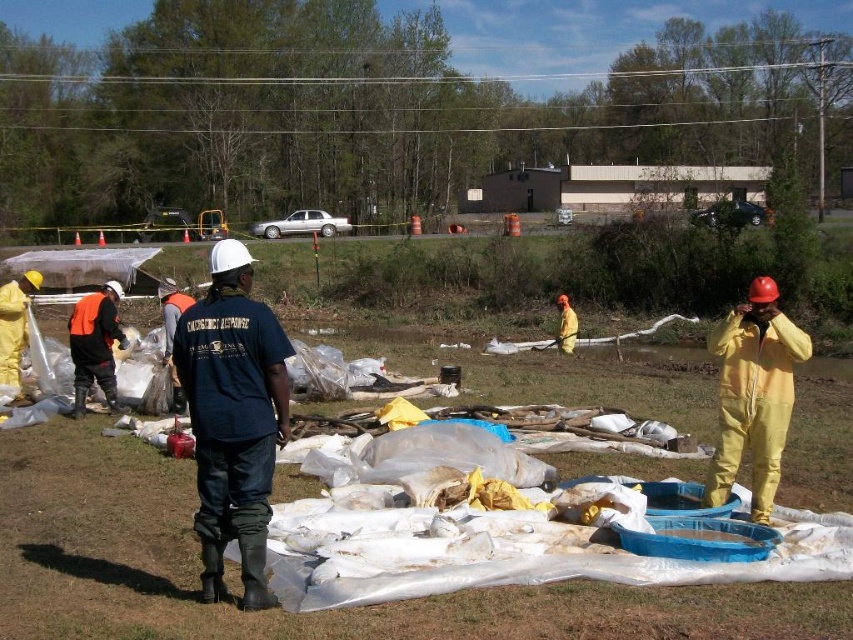
Can you confirm if yellow rubber boots at center is thinner than yellow matte suit at right?

In fact, yellow rubber boots at center might be wider than yellow matte suit at right.

Who is taller, yellow rubber boots at center or yellow matte suit at right?

yellow rubber boots at center

What do you see at coordinates (276, 611) in the screenshot?
I see `yellow rubber boots at center` at bounding box center [276, 611].

At what (x,y) coordinates should I click in order to perform the action: click on yellow rubber boots at center. Please return your answer as a coordinate pair (x, y). Looking at the image, I should click on (276, 611).

Between yellow rubber boots at center and black matte shirt at center, which one is positioned lower?

Positioned lower is black matte shirt at center.

Consider the image. Is yellow rubber boots at center to the left of black matte shirt at center from the viewer's perspective?

No, yellow rubber boots at center is not to the left of black matte shirt at center.

Where is `yellow rubber boots at center`? The width and height of the screenshot is (853, 640). yellow rubber boots at center is located at coordinates click(276, 611).

Does black matte shirt at center lie in front of yellow matte suit at right?

Yes, it is.

Describe the element at coordinates (233, 417) in the screenshot. I see `black matte shirt at center` at that location.

Describe the element at coordinates (233, 417) in the screenshot. I see `black matte shirt at center` at that location.

The height and width of the screenshot is (640, 853). What are the coordinates of `black matte shirt at center` in the screenshot? It's located at (233, 417).